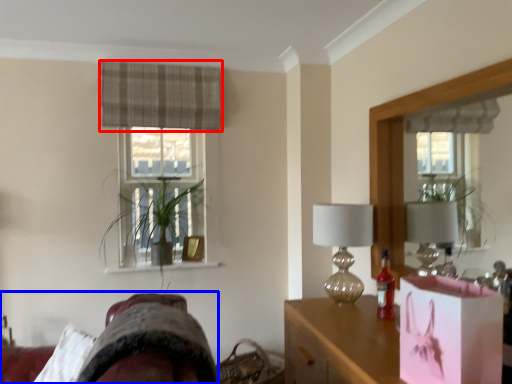
Question: Which point is further to the camera, curtain (highlighted by a red box) or swivel chair (highlighted by a blue box)?

Choices:
 (A) curtain
 (B) swivel chair

Answer: (A)